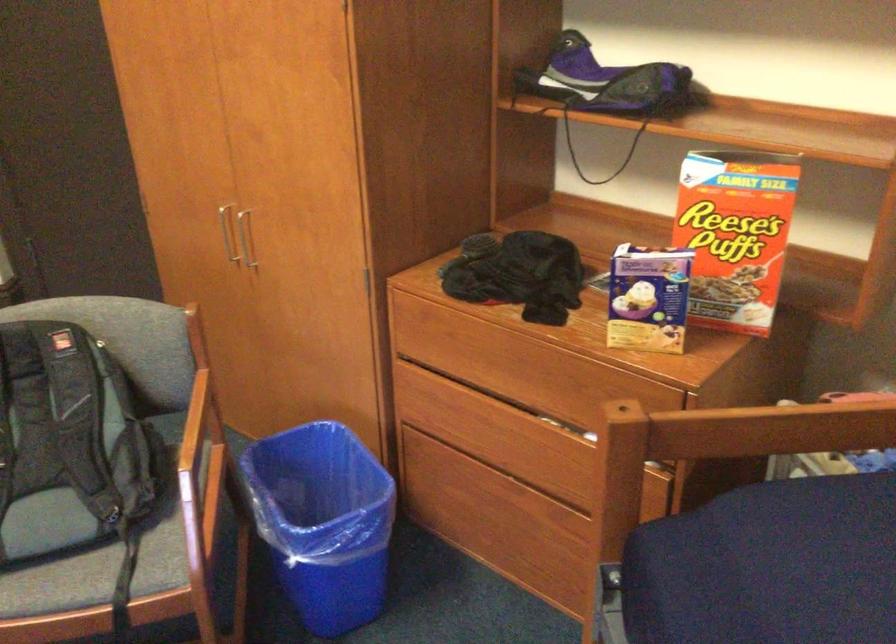
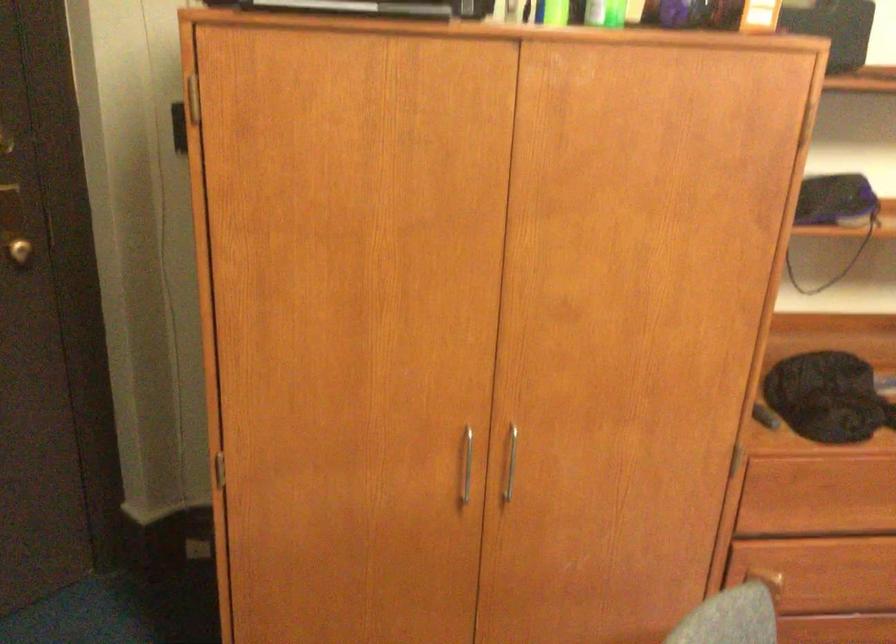
The point at [457,348] is marked in the first image. Where is the corresponding point in the second image?

(825, 495)